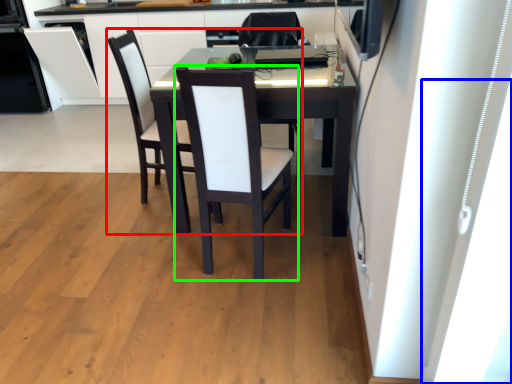
Question: Which object is the closest to the chair (highlighted by a red box)? Choose among these: window (highlighted by a blue box) or chair (highlighted by a green box).

Choices:
 (A) window
 (B) chair

Answer: (B)